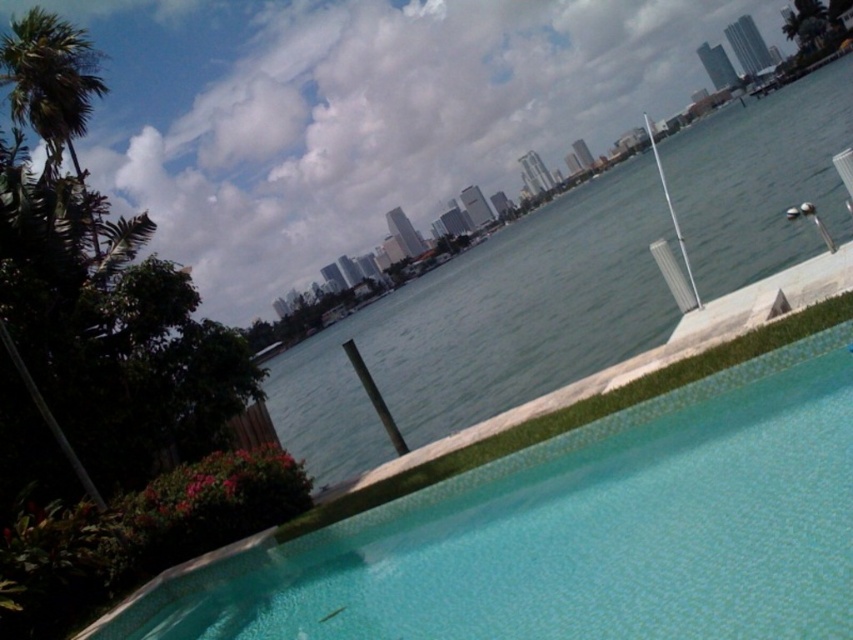
Question: Is clear glass pool at lower right wider than clear water at center?

Choices:
 (A) yes
 (B) no

Answer: (B)

Question: Which of the following is the closest to the observer?

Choices:
 (A) (265, 616)
 (B) (508, 317)

Answer: (A)

Question: Which of the following is the closest to the observer?

Choices:
 (A) (804, 236)
 (B) (706, 364)

Answer: (B)

Question: Can you confirm if clear glass pool at lower right is bigger than clear water at center?

Choices:
 (A) yes
 (B) no

Answer: (B)

Question: Among these objects, which one is farthest from the camera?

Choices:
 (A) clear glass pool at lower right
 (B) clear water at center

Answer: (B)

Question: Is clear glass pool at lower right wider than clear water at center?

Choices:
 (A) yes
 (B) no

Answer: (B)